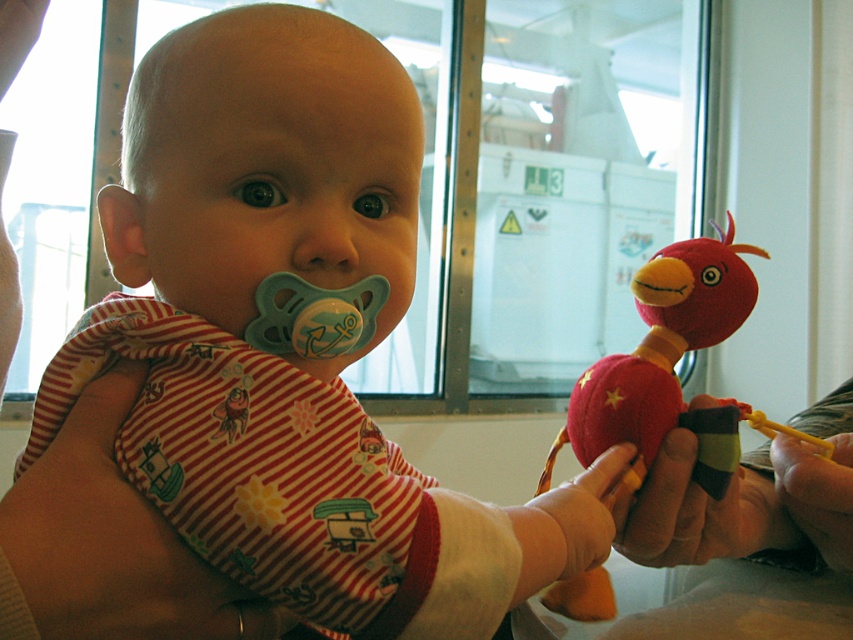
Question: Does matte plastic pacifier at center have a lesser width compared to fuzzy fabric bird at right?

Choices:
 (A) yes
 (B) no

Answer: (A)

Question: Is matte plastic pacifier at center smaller than fuzzy fabric bird at right?

Choices:
 (A) yes
 (B) no

Answer: (A)

Question: Among these objects, which one is nearest to the camera?

Choices:
 (A) matte plastic pacifier at center
 (B) fuzzy fabric bird at right

Answer: (A)

Question: Can you confirm if matte plastic pacifier at center is positioned to the left of fuzzy fabric bird at right?

Choices:
 (A) yes
 (B) no

Answer: (A)